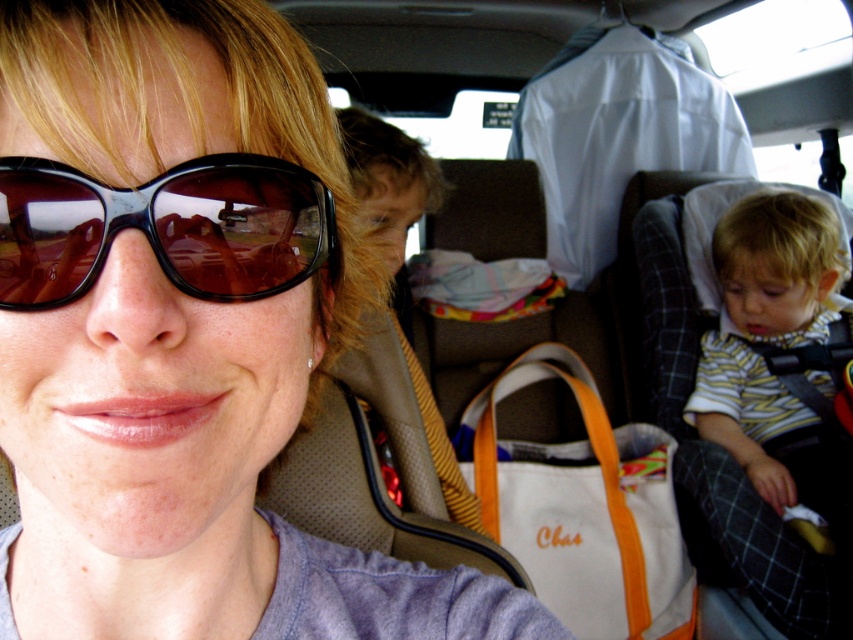
You are a designer creating a layout for a magazine spread. You need to place the black glossy sunglasses at center and the striped cotton shirt at right in a way that maintains their relative proportions as seen in the original image. Which object should you make thinner in your design?

The black glossy sunglasses at center should be made thinner in the design since it is thinner than the striped cotton shirt at right in the original image.

You are a passenger in the vehicle and want to hand the black glossy sunglasses at center to the driver who is seated to your right. Can you reach them without moving your seat?

The black glossy sunglasses at center is 11.01 inches from the viewer. Since this distance is relatively short, you can likely reach them without moving your seat.